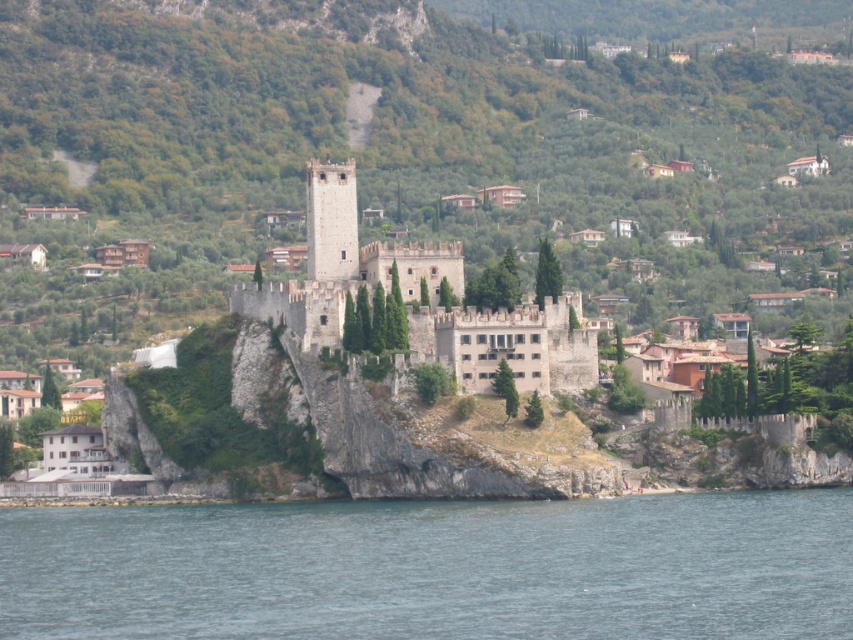
You are standing at the base of the castle and want to reach the point marked as point (712, 636). Given that your walking speed is 1.2 meters per second, how long will it take you to reach that point?

The point (712, 636) is 70.44 meters away from the viewer. At a walking speed of 1.2 meters per second, it would take approximately 58.7 seconds to reach it.

You are a tourist standing at the base of the white stone castle at center and want to take a photo of the clear blue water at lower center. Based on their heights, will the water be fully visible in your photo without any obstructions from the castle?

The clear blue water at lower center has a lesser height compared to the white stone castle at center. Since the water is lower, it will be fully visible in your photo without any obstructions from the castle.

You are a tourist standing on the hill behind the white stone castle at center. You want to take a photo of the castle and the clear blue water at lower center. In which direction should you move to ensure both the castle and the water are in the same frame?

Since the clear blue water at lower center is below the white stone castle at center, you should move to a lower position to ensure both the castle and the water are visible in the same frame.